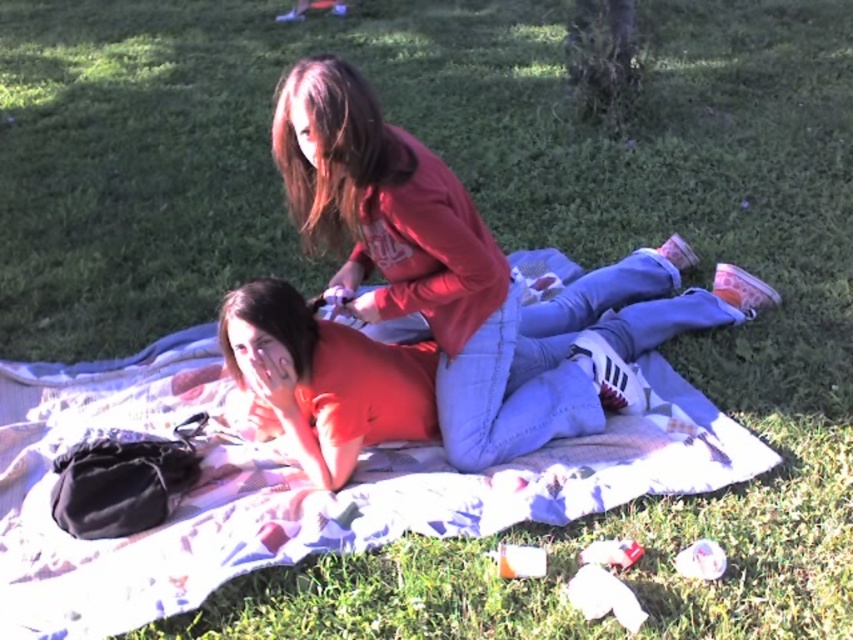
Question: Which point appears closest to the camera in this image?

Choices:
 (A) (4, 364)
 (B) (616, 346)
 (C) (492, 253)

Answer: (C)

Question: Estimate the real-world distances between objects in this image. Which object is closer to the orange matte shirt at center?

Choices:
 (A) white cotton blanket at center
 (B) matte red shirt at center

Answer: (B)

Question: Based on their relative distances, which object is farther from the white cotton blanket at center?

Choices:
 (A) matte red shirt at center
 (B) orange matte shirt at center

Answer: (A)

Question: Is white cotton blanket at center further to the viewer compared to orange matte shirt at center?

Choices:
 (A) no
 (B) yes

Answer: (A)

Question: Does white cotton blanket at center have a larger size compared to matte red shirt at center?

Choices:
 (A) no
 (B) yes

Answer: (B)

Question: Is orange matte shirt at center positioned in front of matte red shirt at center?

Choices:
 (A) no
 (B) yes

Answer: (A)